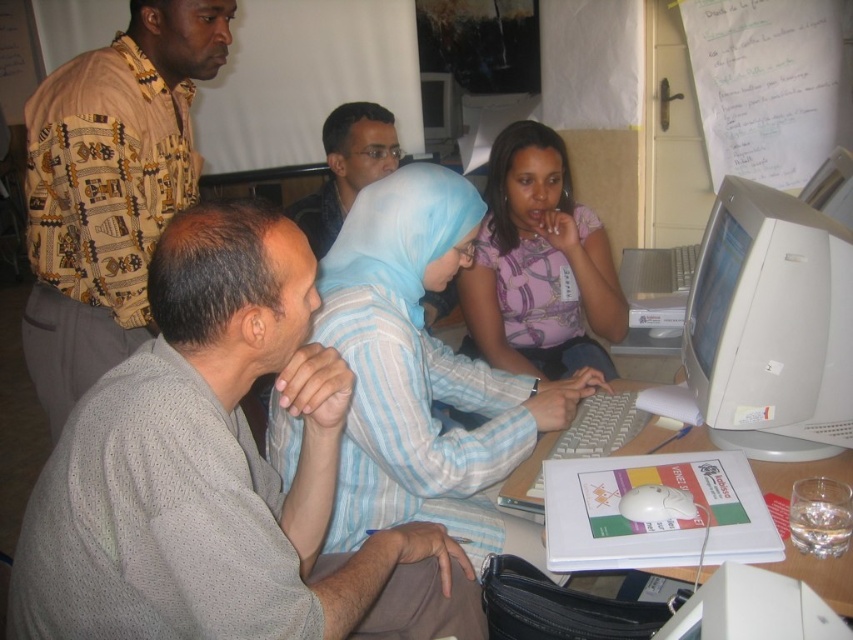
You are a GUI agent. You are given a task and a screenshot of the screen. Output one action in this format:
    pyautogui.click(x=<x>, y=<y>)
    Task: Click on the purple printed shirt at center
    The image size is (853, 640).
    Given the screenshot: What is the action you would take?
    pyautogui.click(x=538, y=266)

Is purple printed shirt at center above white plastic table at center?

Indeed, purple printed shirt at center is positioned over white plastic table at center.

Does point (514, 214) come in front of point (785, 488)?

No.

Where is `purple printed shirt at center`? This screenshot has width=853, height=640. purple printed shirt at center is located at coordinates (538, 266).

Does gray dotted shirt at lower left appear over white plastic table at center?

No, gray dotted shirt at lower left is not above white plastic table at center.

Between gray dotted shirt at lower left and white plastic table at center, which one has more height?

gray dotted shirt at lower left

The height and width of the screenshot is (640, 853). Identify the location of gray dotted shirt at lower left. (219, 474).

Who is positioned more to the left, printed fabric shirt at upper left or white plastic monitor at right?

printed fabric shirt at upper left

Is printed fabric shirt at upper left above white plastic monitor at right?

Correct, printed fabric shirt at upper left is located above white plastic monitor at right.

You are a GUI agent. You are given a task and a screenshot of the screen. Output one action in this format:
    pyautogui.click(x=<x>, y=<y>)
    Task: Click on the printed fabric shirt at upper left
    This screenshot has height=640, width=853.
    Given the screenshot: What is the action you would take?
    pyautogui.click(x=109, y=188)